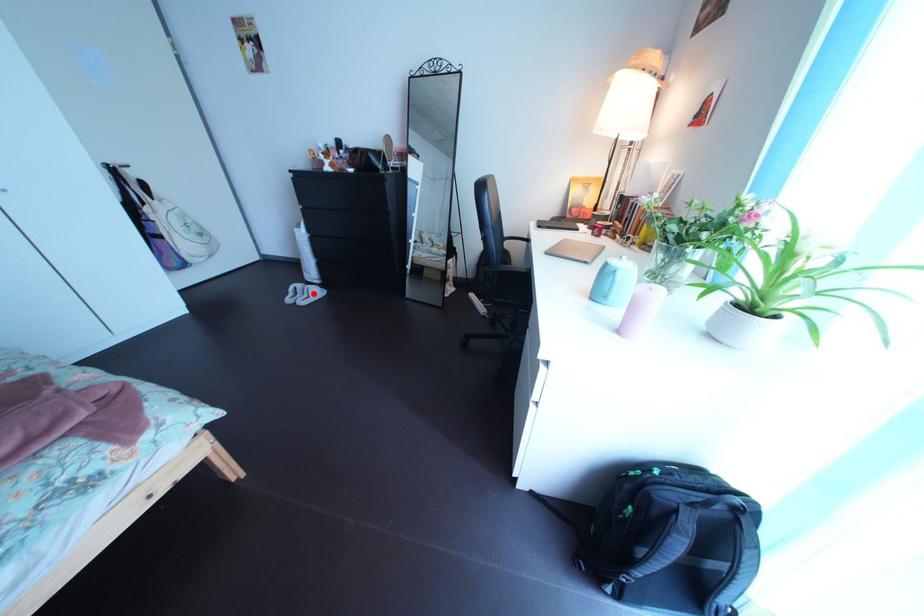
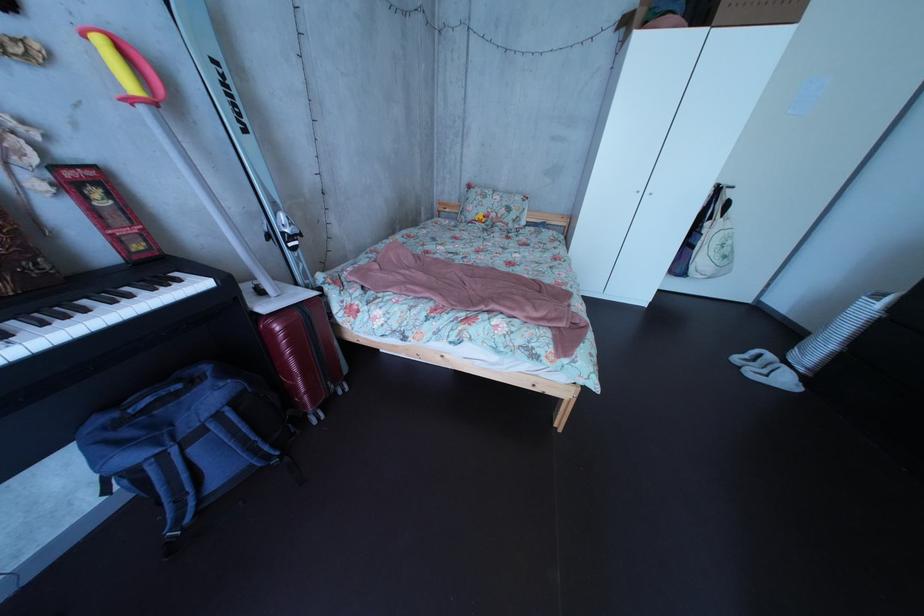
Where in the second image is the point corresponding to the highlighted location from the first image?

(784, 363)